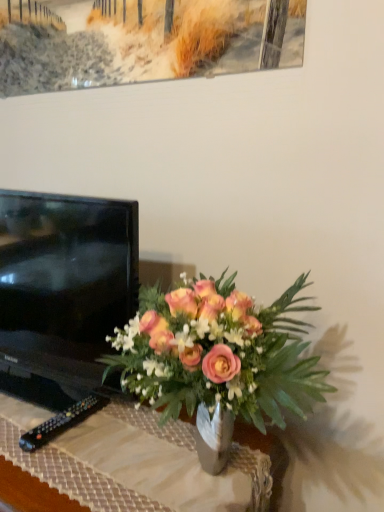
Question: Is matte glass vase at center oriented towards matte glass vase at center?

Choices:
 (A) no
 (B) yes

Answer: (A)

Question: Does matte glass vase at center have a lesser height compared to matte glass vase at center?

Choices:
 (A) no
 (B) yes

Answer: (B)

Question: Is matte glass vase at center completely or partially outside of matte glass vase at center?

Choices:
 (A) yes
 (B) no

Answer: (A)

Question: Is matte glass vase at center looking in the opposite direction of matte glass vase at center?

Choices:
 (A) no
 (B) yes

Answer: (A)

Question: Can you confirm if matte glass vase at center is thinner than matte glass vase at center?

Choices:
 (A) no
 (B) yes

Answer: (B)

Question: Is matte glass vase at center closer to the viewer compared to matte glass vase at center?

Choices:
 (A) no
 (B) yes

Answer: (B)

Question: Is black plastic remote at lower left to the right of matte glass vase at center from the viewer's perspective?

Choices:
 (A) no
 (B) yes

Answer: (B)

Question: From a real-world perspective, is black plastic remote at lower left over matte glass vase at center?

Choices:
 (A) no
 (B) yes

Answer: (B)

Question: Does black plastic remote at lower left appear on the left side of matte glass vase at center?

Choices:
 (A) yes
 (B) no

Answer: (B)

Question: Does black plastic remote at lower left have a smaller size compared to matte glass vase at center?

Choices:
 (A) no
 (B) yes

Answer: (B)

Question: Is black plastic remote at lower left closer to the viewer compared to matte glass vase at center?

Choices:
 (A) yes
 (B) no

Answer: (B)

Question: Is black plastic remote at lower left oriented towards matte glass vase at center?

Choices:
 (A) no
 (B) yes

Answer: (B)

Question: Does matte glass vase at center lie behind black glossy tv at left?

Choices:
 (A) no
 (B) yes

Answer: (A)